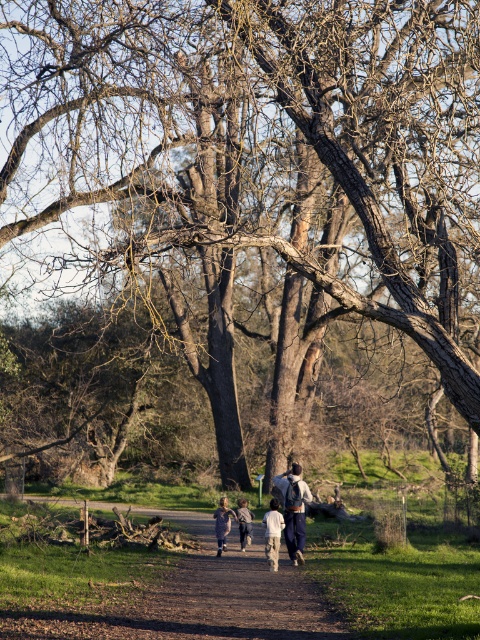
Which of these two, dark blue jeans at center or white cotton shirt at center, stands taller?

With more height is dark blue jeans at center.

Between dark blue jeans at center and white cotton shirt at center, which one appears on the left side from the viewer's perspective?

From the viewer's perspective, white cotton shirt at center appears more on the left side.

In order to click on dark blue jeans at center in this screenshot , I will do `click(294, 509)`.

Between light brown leather backpack at center and white cotton shirt at center, which one is positioned lower?

Positioned lower is white cotton shirt at center.

Is light brown leather backpack at center wider than white cotton shirt at center?

Yes, light brown leather backpack at center is wider than white cotton shirt at center.

Measure the distance between light brown leather backpack at center and camera.

The distance of light brown leather backpack at center from camera is 81.97 feet.

Find the location of a particular element. light brown leather backpack at center is located at coordinates (288, 516).

Is point (307, 486) closer to viewer compared to point (247, 532)?

Yes.

Between dark blue jeans at center and light brown fabric jacket at center, which one has less height?

Standing shorter between the two is light brown fabric jacket at center.

Is point (310, 497) in front of point (240, 541)?

Yes, it is.

The image size is (480, 640). Find the location of `dark blue jeans at center`. dark blue jeans at center is located at coordinates (294, 509).